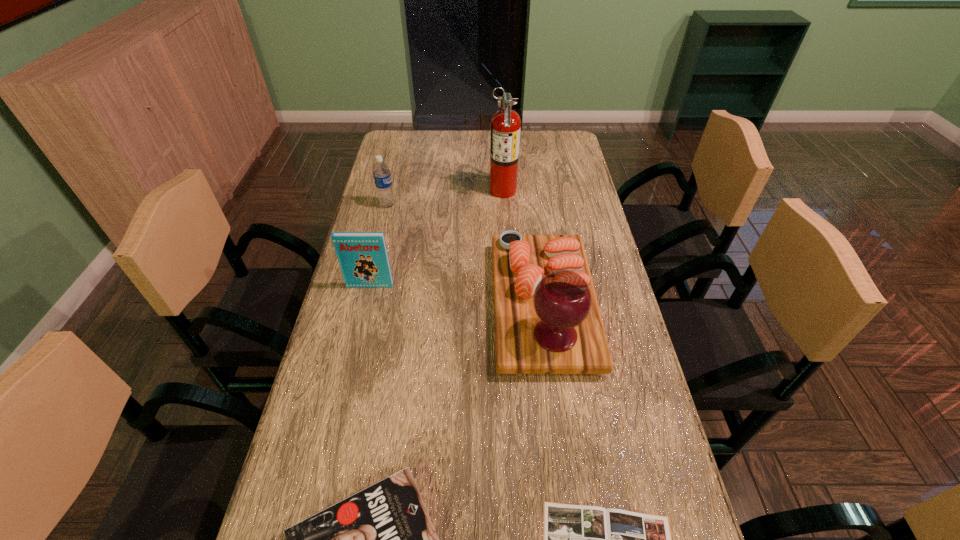
Identify the location of object that ranks as the third closest to the water bottle. This screenshot has height=540, width=960. (547, 320).

Find the location of a particular element. The image size is (960, 540). book that is the second closest to the shortest book is located at coordinates (363, 258).

Where is `book that is the second closest to the farthest book`? This screenshot has height=540, width=960. book that is the second closest to the farthest book is located at coordinates (577, 539).

Find the location of a particular element. vacant space that satisfies the following two spatial constraints: 1. on the nozzle side of the tallest object; 2. on the front cover of the farthest book is located at coordinates (509, 286).

At what (x,y) coordinates should I click in order to perform the action: click on blank space that satisfies the following two spatial constraints: 1. on the nozzle side of the fire extinguisher; 2. on the front cover of the farthest book. Please return your answer as a coordinate pair (x, y). Looking at the image, I should click on (509, 286).